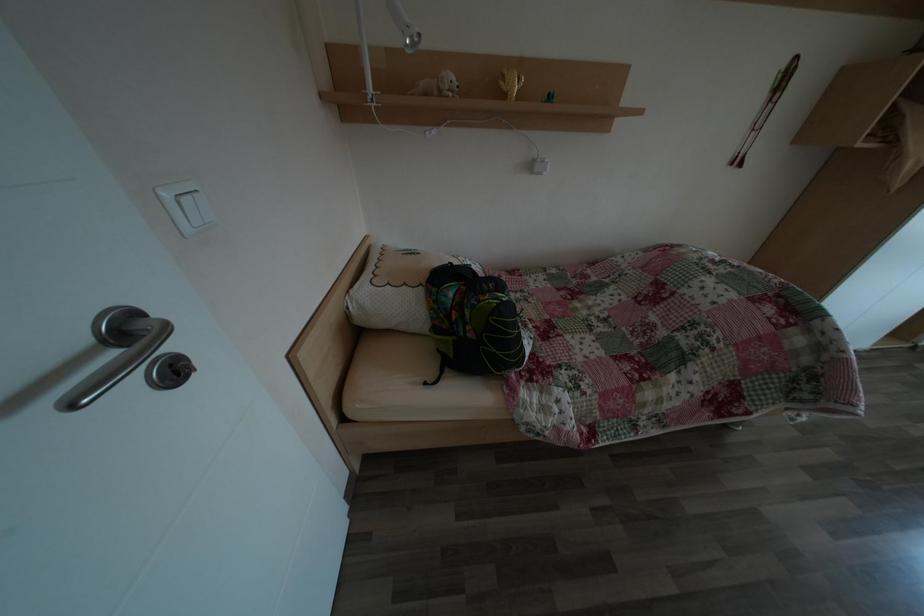
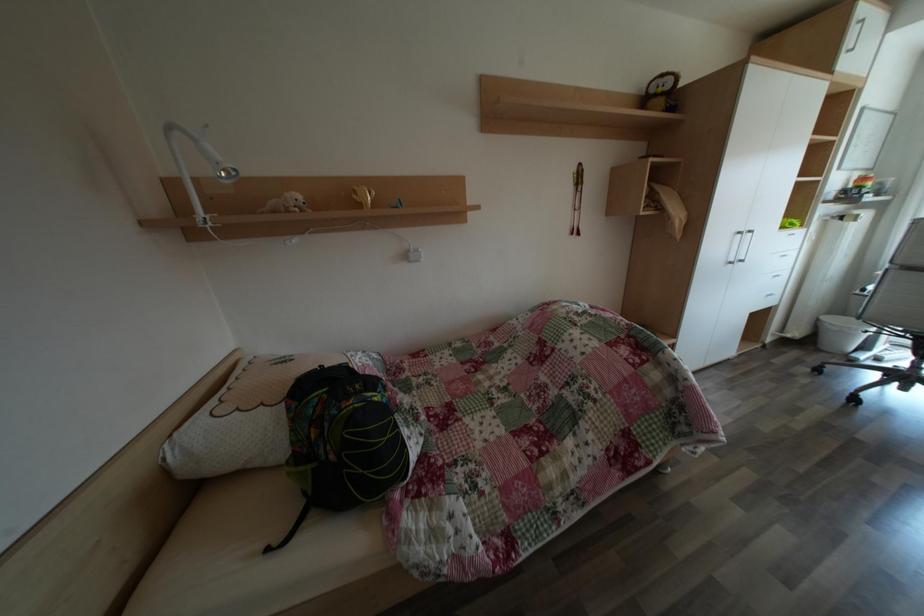
Question: The images are taken continuously from a first-person perspective. In which direction is your viewpoint rotating?

Choices:
 (A) Left
 (B) Right
 (C) Up
 (D) Down

Answer: (C)